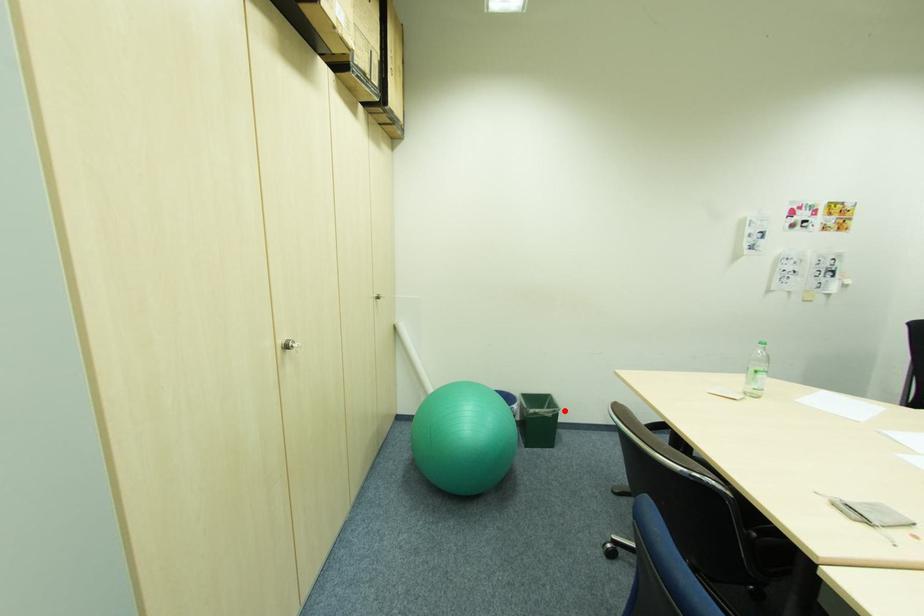
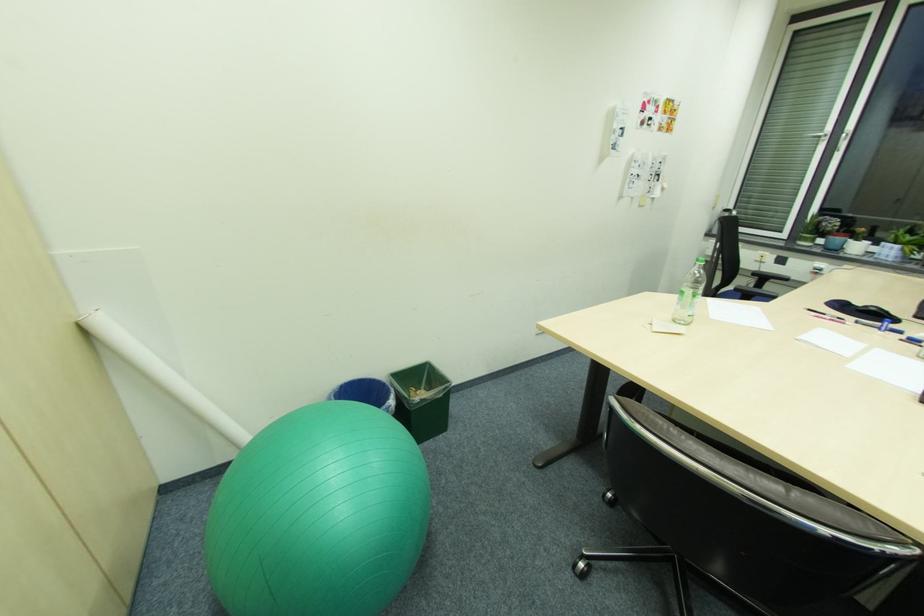
The point at the highlighted location is marked in the first image. Where is the corresponding point in the second image?

(456, 385)